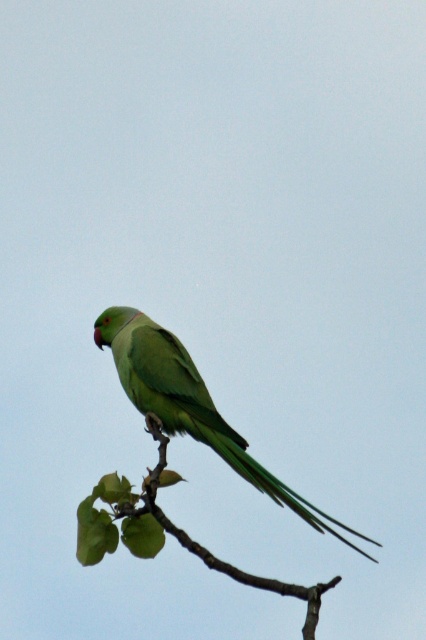
You are an ornithologist observing a green matte parrot at center perched on a green matte tree branch at center. Based on their widths, which object would require more space when transporting them individually in a narrow container?

The green matte parrot at center might be wider than the green matte tree branch at center, so it would require more space in a narrow container.

You are standing in front of the parrot and want to place a small treat between the two points, point (x=175, y=429) and point (x=325, y=588). Which point should you aim for to place the treat closer to the parrot?

You should aim for point (x=175, y=429) because it is closer to the parrot than point (x=325, y=588).

You are an ornithologist observing the green matte parrot at center and the green matte tree branch at center in the image. Which object occupies more vertical space in the scene?

The green matte parrot at center has a greater height compared to the green matte tree branch at center, so it occupies more vertical space in the scene.